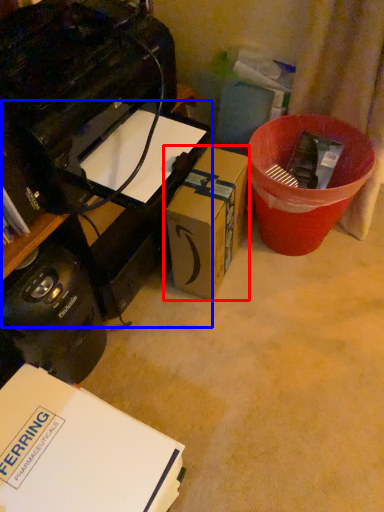
Question: Which object is closer to the camera taking this photo, box (highlighted by a red box) or computer desk (highlighted by a blue box)?

Choices:
 (A) box
 (B) computer desk

Answer: (A)